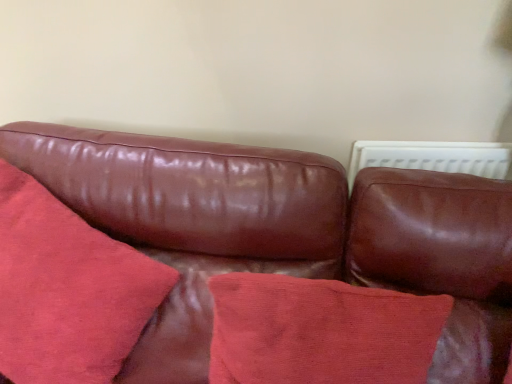
Question: Can you confirm if leather couch at center is thinner than cotton cushion at center, which is the second throw pillow from left to right?

Choices:
 (A) yes
 (B) no

Answer: (B)

Question: Does leather couch at center appear on the left side of cotton cushion at center, the 1th throw pillow in the right-to-left sequence?

Choices:
 (A) no
 (B) yes

Answer: (B)

Question: Is leather couch at center bigger than cotton cushion at center, the 1th throw pillow in the right-to-left sequence?

Choices:
 (A) yes
 (B) no

Answer: (A)

Question: Would you say leather couch at center is outside cotton cushion at center, which is the second throw pillow from left to right?

Choices:
 (A) yes
 (B) no

Answer: (A)

Question: Is leather couch at center next to cotton cushion at center, the 1th throw pillow in the right-to-left sequence, and touching it?

Choices:
 (A) yes
 (B) no

Answer: (B)

Question: Looking at their shapes, would you say suede-like red pillow at center, which is the 1th throw pillow from left to right, is wider or thinner than cotton cushion at center, which is the second throw pillow from left to right?

Choices:
 (A) thin
 (B) wide

Answer: (B)

Question: Is point click(59, 306) positioned closer to the camera than point click(226, 367)?

Choices:
 (A) farther
 (B) closer

Answer: (A)

Question: Relative to cotton cushion at center, which is the second throw pillow from left to right, is suede-like red pillow at center, which is the 1th throw pillow from left to right, in front or behind?

Choices:
 (A) front
 (B) behind

Answer: (A)

Question: In terms of height, does suede-like red pillow at center, which is the 1th throw pillow from left to right, look taller or shorter compared to cotton cushion at center, the 1th throw pillow in the right-to-left sequence?

Choices:
 (A) short
 (B) tall

Answer: (B)

Question: From their relative heights in the image, would you say cotton cushion at center, the 1th throw pillow in the right-to-left sequence, is taller or shorter than leather couch at center?

Choices:
 (A) short
 (B) tall

Answer: (A)

Question: From the image's perspective, is cotton cushion at center, the 1th throw pillow in the right-to-left sequence, positioned above or below leather couch at center?

Choices:
 (A) above
 (B) below

Answer: (A)

Question: Based on their sizes in the image, would you say cotton cushion at center, which is the second throw pillow from left to right, is bigger or smaller than leather couch at center?

Choices:
 (A) big
 (B) small

Answer: (B)

Question: Is point (253, 301) closer or farther from the camera than point (404, 198)?

Choices:
 (A) farther
 (B) closer

Answer: (B)

Question: In terms of size, does suede-like red pillow at center, which is the 1th throw pillow from left to right, appear bigger or smaller than leather couch at center?

Choices:
 (A) small
 (B) big

Answer: (A)

Question: Considering the positions of suede-like red pillow at center, which is the 1th throw pillow from left to right, and leather couch at center in the image, is suede-like red pillow at center, which is the 1th throw pillow from left to right, taller or shorter than leather couch at center?

Choices:
 (A) short
 (B) tall

Answer: (A)